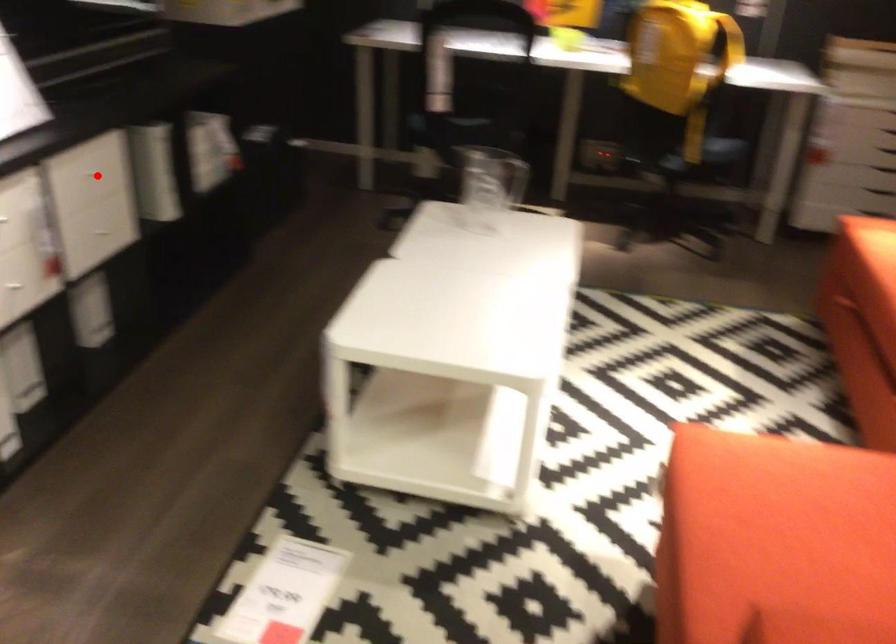
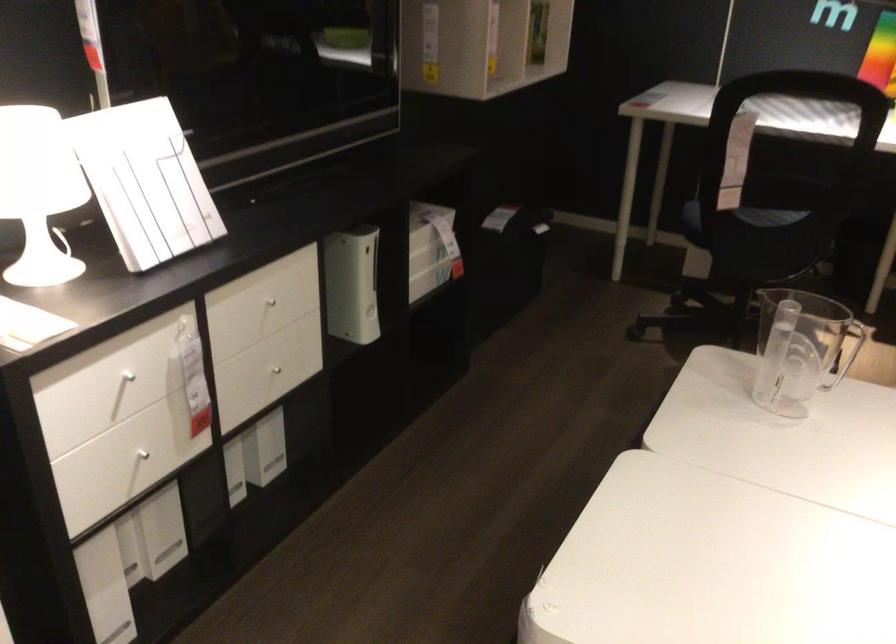
In the second image, find the point that corresponds to the highlighted location in the first image.

(271, 299)